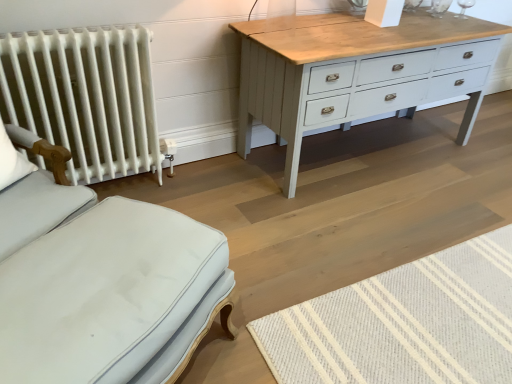
Question: Is natural wool mat at lower right taller than white fabric pillow at left?

Choices:
 (A) no
 (B) yes

Answer: (A)

Question: From a real-world perspective, is natural wool mat at lower right under white fabric pillow at left?

Choices:
 (A) yes
 (B) no

Answer: (A)

Question: Does natural wool mat at lower right have a lesser height compared to white fabric pillow at left?

Choices:
 (A) yes
 (B) no

Answer: (A)

Question: Can you confirm if natural wool mat at lower right is thinner than white fabric pillow at left?

Choices:
 (A) no
 (B) yes

Answer: (A)

Question: Is natural wool mat at lower right positioned before white fabric pillow at left?

Choices:
 (A) no
 (B) yes

Answer: (B)

Question: Is natural wool mat at lower right not near white fabric pillow at left?

Choices:
 (A) yes
 (B) no

Answer: (A)

Question: From the image's perspective, is light blue fabric ottoman at lower left over natural wool mat at lower right?

Choices:
 (A) yes
 (B) no

Answer: (A)

Question: Considering the relative sizes of light blue fabric ottoman at lower left and natural wool mat at lower right in the image provided, is light blue fabric ottoman at lower left shorter than natural wool mat at lower right?

Choices:
 (A) no
 (B) yes

Answer: (A)

Question: Is light blue fabric ottoman at lower left aimed at natural wool mat at lower right?

Choices:
 (A) yes
 (B) no

Answer: (B)

Question: Does light blue fabric ottoman at lower left touch natural wool mat at lower right?

Choices:
 (A) no
 (B) yes

Answer: (A)

Question: From a real-world perspective, is light blue fabric ottoman at lower left below natural wool mat at lower right?

Choices:
 (A) no
 (B) yes

Answer: (A)

Question: Can you confirm if light blue fabric ottoman at lower left is positioned to the left of natural wool mat at lower right?

Choices:
 (A) no
 (B) yes

Answer: (B)

Question: From a real-world perspective, is white painted radiator at left physically below natural wool mat at lower right?

Choices:
 (A) yes
 (B) no

Answer: (B)